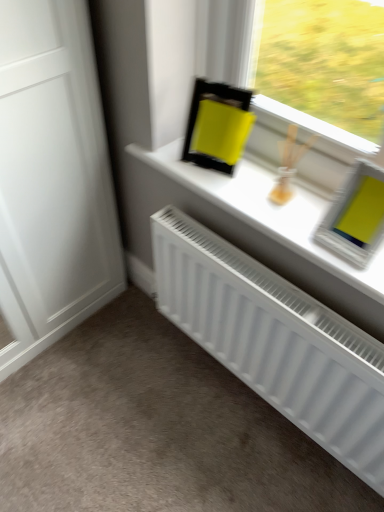
Question: From the image's perspective, relative to white matte radiator at lower center, is white matte window sill at upper center above or below?

Choices:
 (A) below
 (B) above

Answer: (B)

Question: Based on their sizes in the image, would you say white matte window sill at upper center is bigger or smaller than white matte radiator at lower center?

Choices:
 (A) small
 (B) big

Answer: (A)

Question: Considering the real-world distances, which object is closest to the white matte window sill at upper center?

Choices:
 (A) white matte radiator at lower center
 (B) white matte radiator at lower center

Answer: (A)

Question: Which object is the closest to the white matte window sill at upper center?

Choices:
 (A) white matte radiator at lower center
 (B) white matte radiator at lower center

Answer: (B)